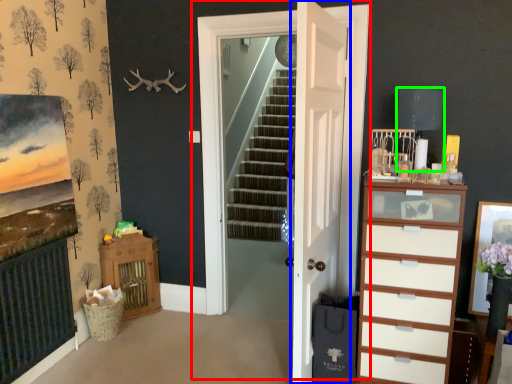
Question: Estimate the real-world distances between objects in this image. Which object is closer to door (highlighted by a red box), door (highlighted by a blue box) or lamp (highlighted by a green box)?

Choices:
 (A) door
 (B) lamp

Answer: (A)